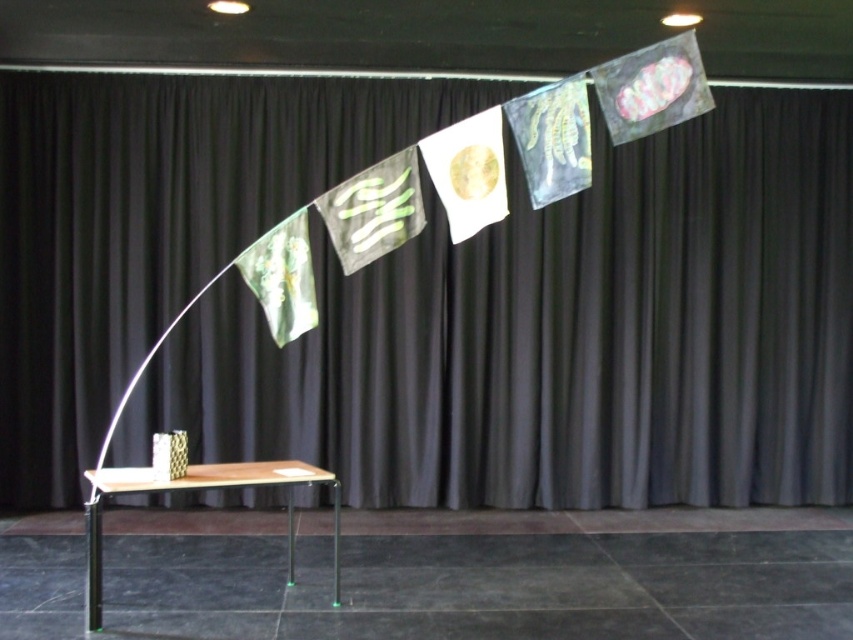
Is black fabric curtain at upper center bigger than wooden table at center?

Incorrect, black fabric curtain at upper center is not larger than wooden table at center.

The width and height of the screenshot is (853, 640). What do you see at coordinates (564, 337) in the screenshot? I see `black fabric curtain at upper center` at bounding box center [564, 337].

Identify the location of black fabric curtain at upper center. (564, 337).